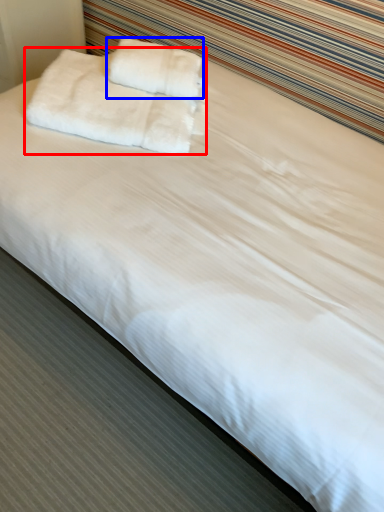
Question: Which object appears farthest to the camera in this image, towel (highlighted by a red box) or towel (highlighted by a blue box)?

Choices:
 (A) towel
 (B) towel

Answer: (B)